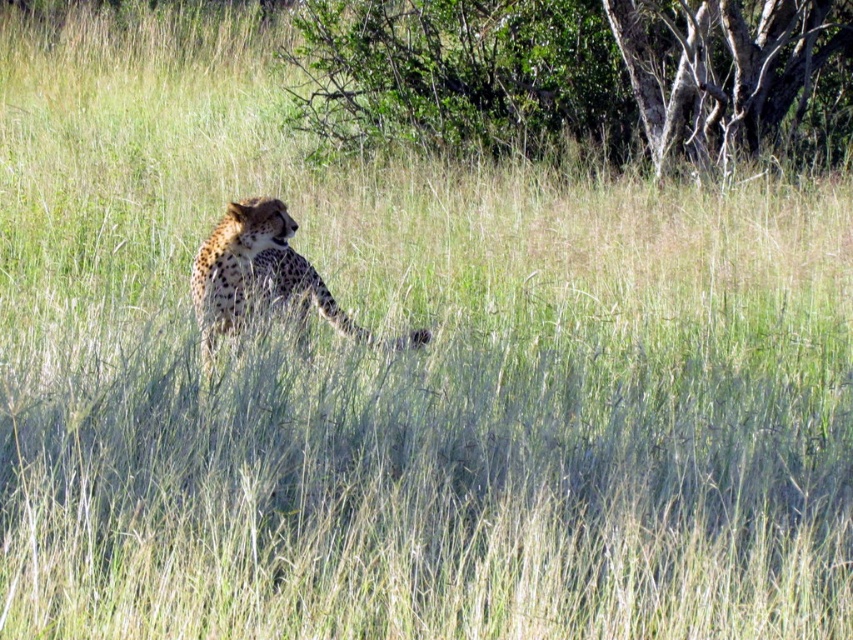
Question: Is green leafy tree at upper center wider than smooth bark tree at upper right?

Choices:
 (A) no
 (B) yes

Answer: (A)

Question: Can you confirm if smooth bark tree at upper right is smaller than spotted fur cheetah at center?

Choices:
 (A) yes
 (B) no

Answer: (B)

Question: Among these points, which one is nearest to the camera?

Choices:
 (A) [416, 92]
 (B) [219, 237]
 (C) [720, 132]

Answer: (B)

Question: Which point is closer to the camera?

Choices:
 (A) (245, 252)
 (B) (776, 118)
 (C) (605, 99)

Answer: (A)

Question: Is green leafy tree at upper center to the left of spotted fur cheetah at center from the viewer's perspective?

Choices:
 (A) yes
 (B) no

Answer: (A)

Question: Which object is the closest to the spotted fur cheetah at center?

Choices:
 (A) green leafy tree at upper center
 (B) smooth bark tree at upper right

Answer: (B)